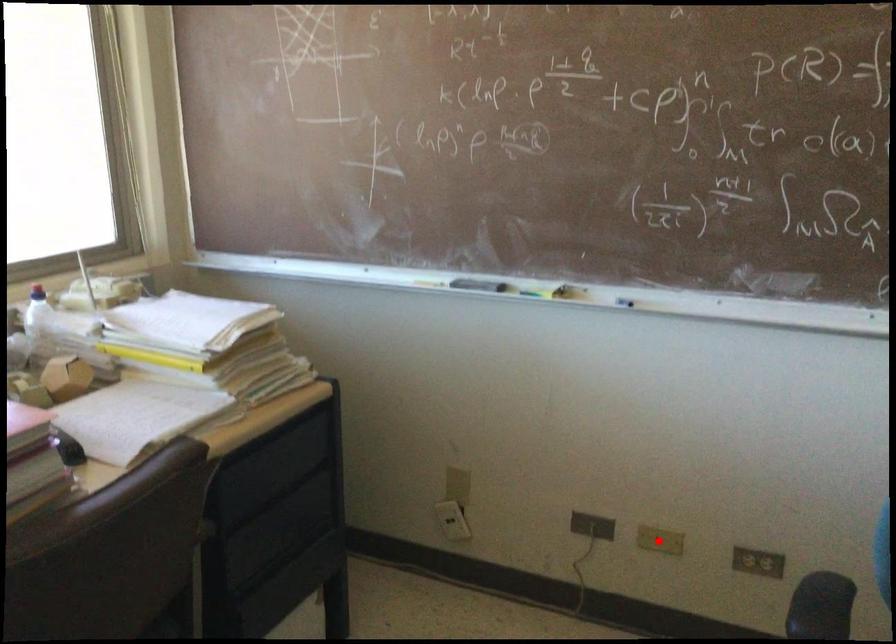
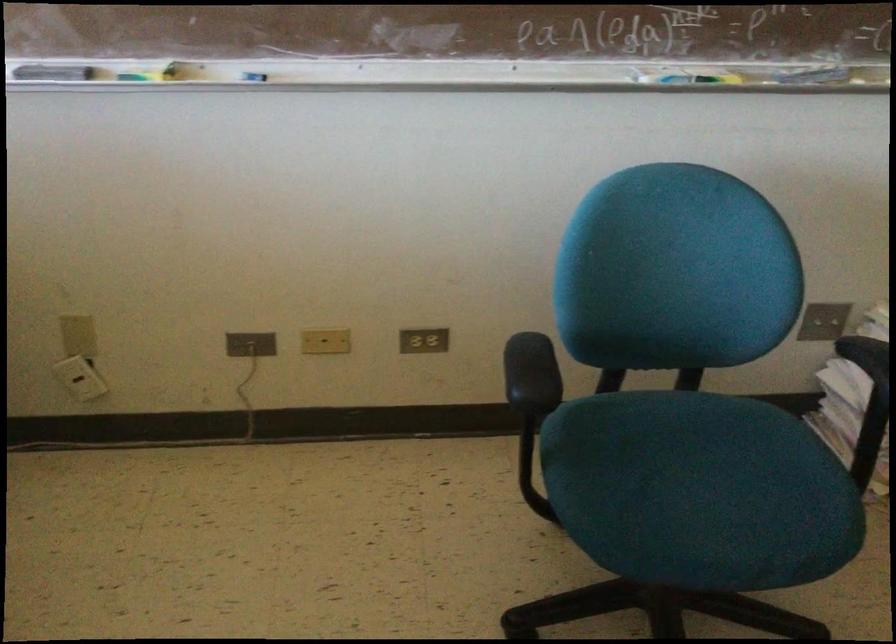
Locate, in the second image, the point that corresponds to the highlighted location in the first image.

(325, 341)